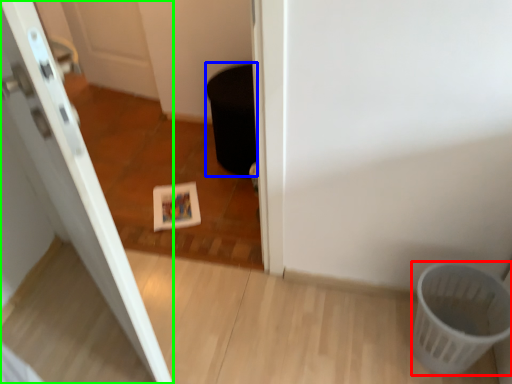
Question: Considering the real-world distances, which object is farthest from basket (highlighted by a red box)? potty (highlighted by a blue box) or door (highlighted by a green box)?

Choices:
 (A) potty
 (B) door

Answer: (A)